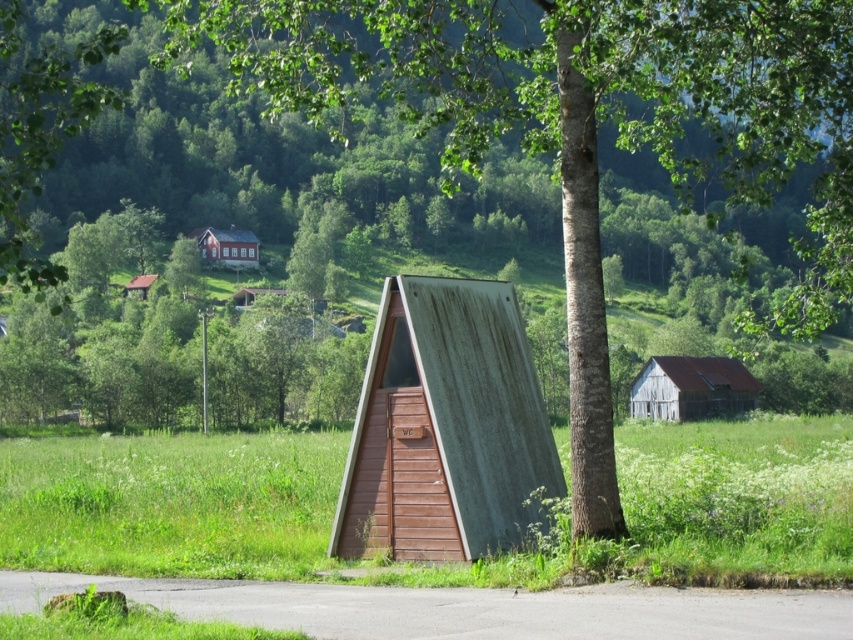
You are standing on the paved road looking towards the rusty corrugated metal hut at center. Can you see the green grass at lower center in front of the hut?

Yes, the green grass at lower center is in front of the rusty corrugated metal hut at center, so it is visible from your position on the road.

You are standing on the paved road near the rusty corrugated metal hut at center and want to walk towards the matte red cabin at upper center. Which direction should you head to reach it?

The rusty corrugated metal hut at center is positioned under the matte red cabin at upper center, so you should head upward from the rusty corrugated metal hut at center to reach the matte red cabin at upper center.

You are a delivery driver who needs to park your truck near the rusty metal shed at center. The truck requires a parking space that is at least 5 meters long. Given the coordinates of the shed, can you determine if there is enough space to park your truck without blocking the road?

The coordinates of the rusty metal shed at center are at point (445, 426). However, without knowing the dimensions of the parking area or the exact layout around the shed, it is impossible to determine if there is sufficient space to park the truck without blocking the road. Additional information about the available space is needed to make this assessment.